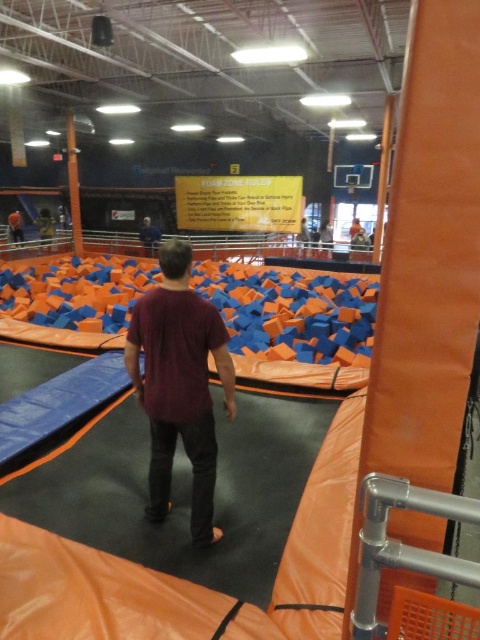
Which is behind, point (163, 308) or point (22, 237)?

Positioned behind is point (22, 237).

Based on the photo, is maroon t-shirt at center shorter than maroon fabric shirt at center?

No.

Where is `maroon t-shirt at center`? The image size is (480, 640). maroon t-shirt at center is located at coordinates (180, 385).